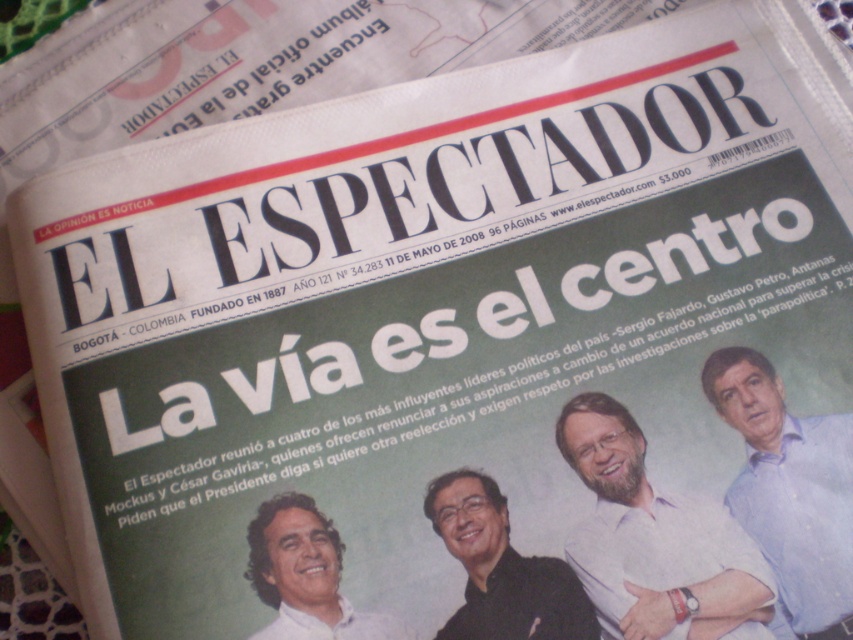
Question: Considering the relative positions of black matte shirt at center and smooth white face at center in the image provided, where is black matte shirt at center located with respect to smooth white face at center?

Choices:
 (A) above
 (B) below

Answer: (A)

Question: Considering the relative positions of black matte shirt at center and smooth white face at center in the image provided, where is black matte shirt at center located with respect to smooth white face at center?

Choices:
 (A) above
 (B) below

Answer: (A)

Question: Does light blue shirt at right have a larger size compared to smooth white face at center?

Choices:
 (A) no
 (B) yes

Answer: (B)

Question: Which object appears closest to the camera in this image?

Choices:
 (A) black matte shirt at center
 (B) light purple shirt at center
 (C) smooth white face at center

Answer: (B)

Question: Which object is positioned farthest from the black matte shirt at center?

Choices:
 (A) light purple shirt at center
 (B) smooth white face at center

Answer: (B)

Question: Which object is closer to the camera taking this photo?

Choices:
 (A) smooth white face at center
 (B) light purple shirt at center

Answer: (B)